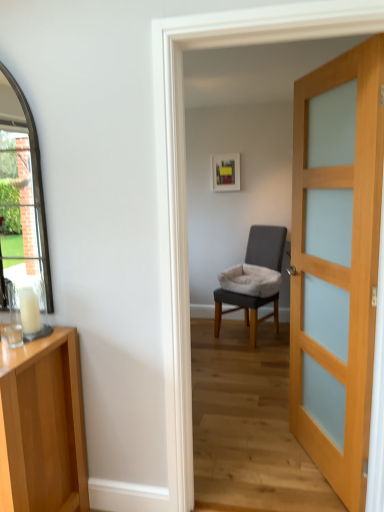
Where is `free region on the left part of wooden door at right`? The image size is (384, 512). free region on the left part of wooden door at right is located at coordinates (258, 466).